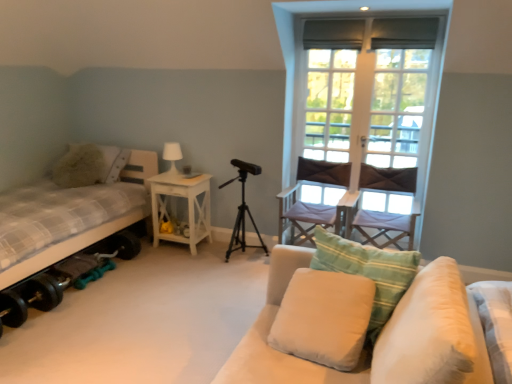
This screenshot has height=384, width=512. What are the coordinates of `vacant region below black matte tripod at center (from a real-world perspective)` in the screenshot? It's located at (249, 263).